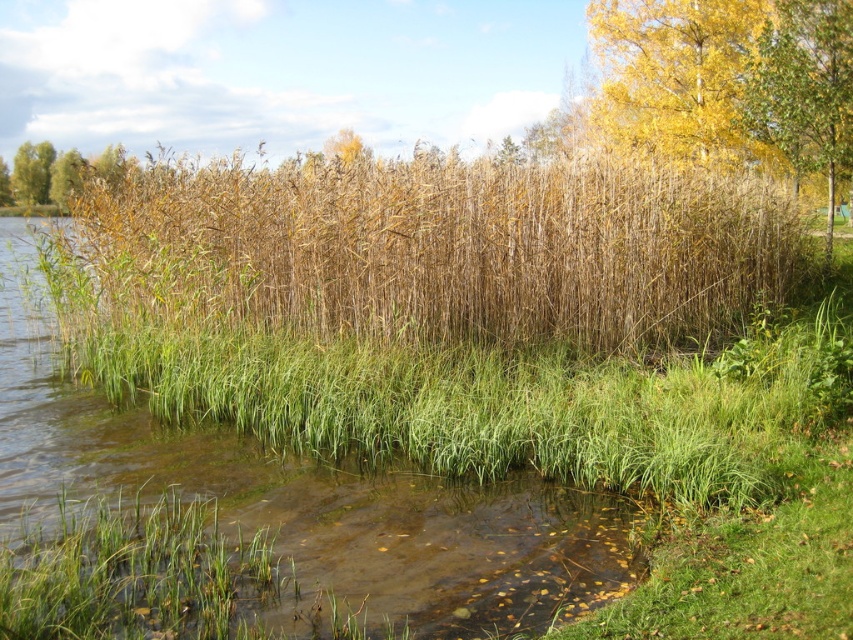
You are planning to install a small garden path between the yellow leafy tree at upper right and the green leafy tree at upper right. The path requires a minimum of 20 feet of space. Can the available distance accommodate the path?

The distance between the yellow leafy tree at upper right and the green leafy tree at upper right is 23.50 feet, which exceeds the required 20 feet. Therefore, the path can be accommodated.

You are a gardener trying to determine which area to water next. Based on the scene, which object is wider and might need more attention? Please refer to the dry grass at center and the green leafy tree at upper right.

The dry grass at center is wider than the green leafy tree at upper right, so it might need more attention as wider areas often require more water.

You are standing at the edge of the water and want to walk to the yellow leafy tree at upper right. Which direction should you head towards from the dry grass at center?

You should head towards the right direction from the dry grass at center because the yellow leafy tree at upper right is located to the right of the dry grass at center.